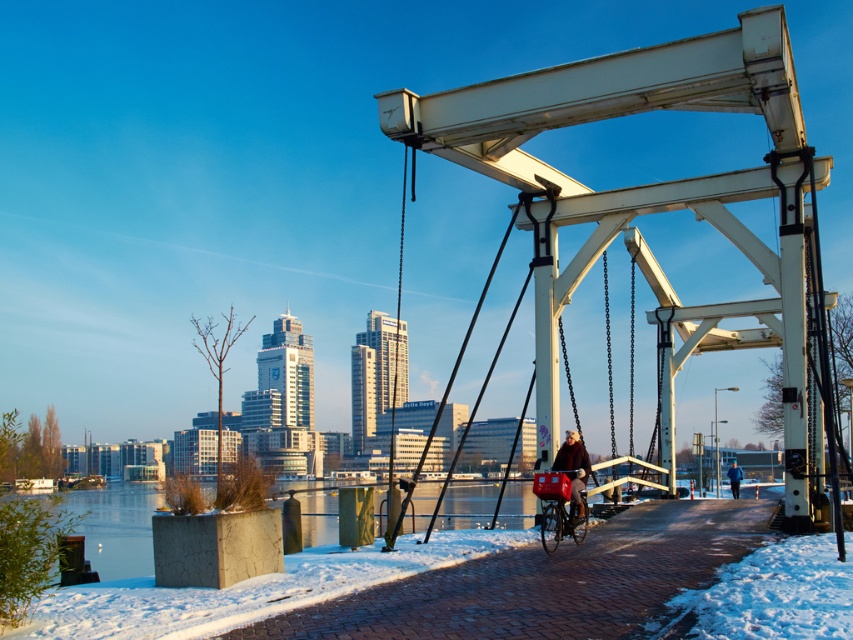
Question: Is matte red bicycle at lower center to the left of dark blue jacket at center from the viewer's perspective?

Choices:
 (A) no
 (B) yes

Answer: (B)

Question: Which point is closer to the camera?

Choices:
 (A) (730, 467)
 (B) (573, 506)

Answer: (B)

Question: Among these points, which one is nearest to the camera?

Choices:
 (A) (735, 474)
 (B) (540, 488)

Answer: (B)

Question: Is matte red bicycle at lower center further to camera compared to dark blue jacket at center?

Choices:
 (A) yes
 (B) no

Answer: (B)

Question: Which point is closer to the camera taking this photo?

Choices:
 (A) (585, 522)
 (B) (730, 490)
 (C) (575, 506)

Answer: (C)

Question: Does matte red bicycle at lower center come in front of dark blue jacket at center?

Choices:
 (A) yes
 (B) no

Answer: (A)